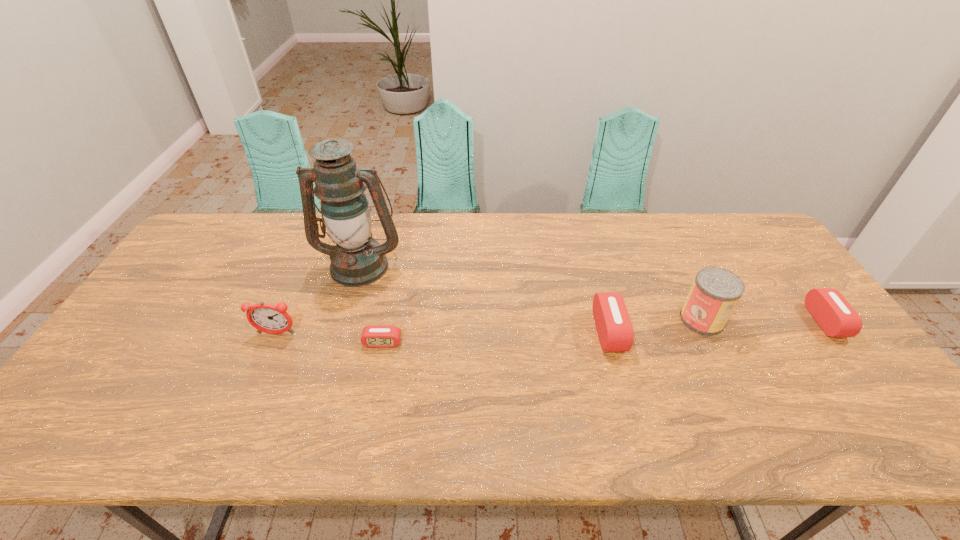
At what (x,y) coordinates should I click in order to perform the action: click on can. Please return your answer as a coordinate pair (x, y). Looking at the image, I should click on (715, 292).

Where is `free space located on the front-facing side of the shortest object`? free space located on the front-facing side of the shortest object is located at coordinates (372, 392).

At what (x,y) coordinates should I click in order to perform the action: click on vacant point located on the front-facing side of the second alarm clock from right to left. Please return your answer as a coordinate pair (x, y). Image resolution: width=960 pixels, height=540 pixels. Looking at the image, I should click on (639, 332).

What are the coordinates of `vacant space situated 0.050m on the front-facing side of the tallest alarm clock` in the screenshot? It's located at (268, 353).

I want to click on free space located on the back of the farthest object, so click(x=375, y=215).

You are a GUI agent. You are given a task and a screenshot of the screen. Output one action in this format:
    pyautogui.click(x=<x>, y=<y>)
    Task: Click on the free space located on the right of the can
    The height and width of the screenshot is (540, 960).
    Given the screenshot: What is the action you would take?
    pyautogui.click(x=777, y=320)

What are the coordinates of `object that is at the far edge` in the screenshot? It's located at (357, 260).

Locate an element on the screen. Image resolution: width=960 pixels, height=540 pixels. object at the right edge is located at coordinates (837, 318).

Find the location of a particular element. Image resolution: width=960 pixels, height=540 pixels. vacant area at the far edge of the desktop is located at coordinates (574, 217).

Find the location of a particular element. This screenshot has height=540, width=960. vacant area at the near edge of the desktop is located at coordinates (498, 404).